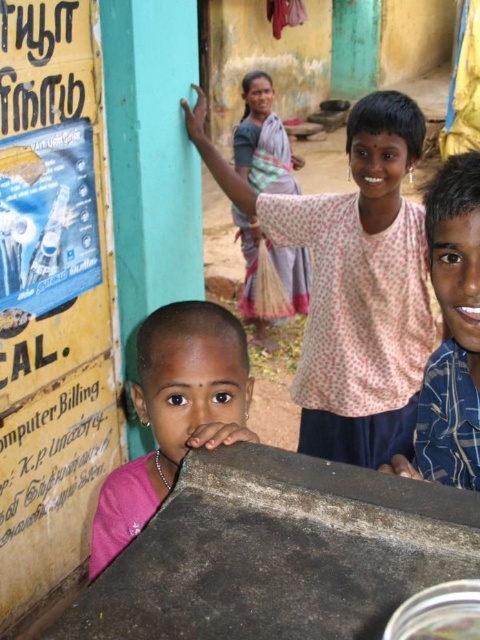
Between pink fabric at upper center and pink fabric at center, which one has more height?

pink fabric at upper center

Is pink fabric at upper center below pink fabric at center?

No.

Is point (323, 408) positioned in front of point (236, 429)?

No, (323, 408) is behind (236, 429).

Find the location of a particular element. pink fabric at upper center is located at coordinates [x=352, y=284].

Does yellow paper at left lie behind blue plaid shirt at upper right?

Yes, yellow paper at left is further from the viewer.

Between point (45, 97) and point (459, 442), which one is positioned behind?

Point (45, 97)

Is point (70, 192) more distant than point (396, 472)?

Yes, it is behind point (396, 472).

This screenshot has height=640, width=480. I want to click on yellow paper at left, so click(x=52, y=296).

Is pink fabric at upper center smaller than blue plaid shirt at upper right?

Incorrect, pink fabric at upper center is not smaller in size than blue plaid shirt at upper right.

Is point (394, 243) positioned before point (479, 419)?

No.

The image size is (480, 640). Find the location of `pink fabric at upper center`. pink fabric at upper center is located at coordinates (352, 284).